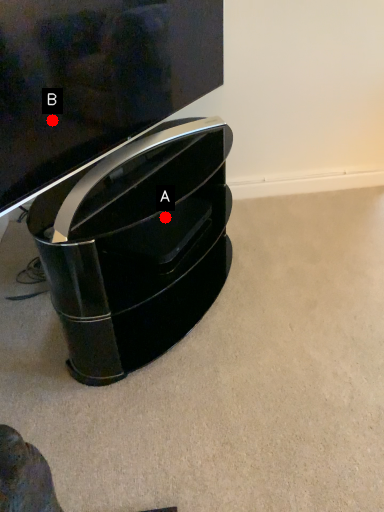
Question: Two points are circled on the image, labeled by A and B beside each circle. Which point is farther to the camera?

Choices:
 (A) A is further
 (B) B is further

Answer: (A)